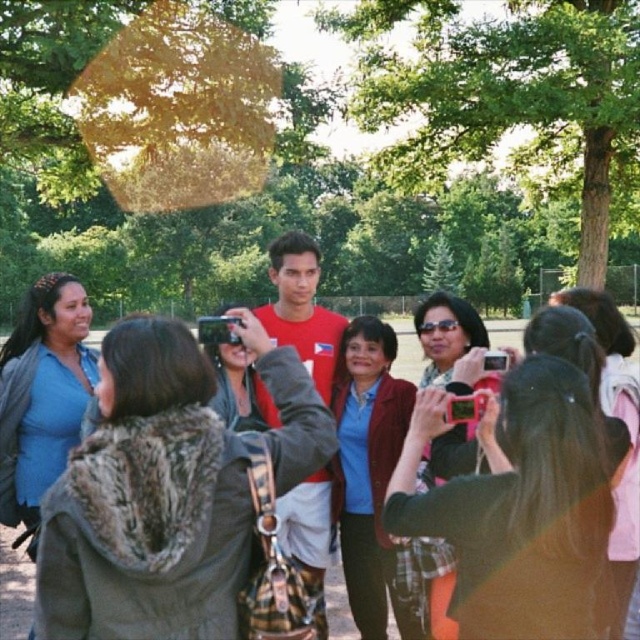
Does matte black jacket at center lie in front of matte blue shirt at center?

Yes, matte black jacket at center is in front of matte blue shirt at center.

Which is in front, point (294, 408) or point (385, 609)?

Point (294, 408) is more forward.

Locate an element on the screen. The image size is (640, 640). matte black jacket at center is located at coordinates (147, 502).

Can you confirm if green leafy tree at center is bigger than matte black sunglasses at center?

Correct, green leafy tree at center is larger in size than matte black sunglasses at center.

Is point (614, 177) positioned after point (452, 355)?

Yes.

Is point (476, 80) closer to camera compared to point (497, 384)?

No, (476, 80) is further to viewer.

Image resolution: width=640 pixels, height=640 pixels. Identify the location of green leafy tree at center. (506, 93).

Identify the location of pink plastic camera at center. The image size is (640, 640). (518, 506).

Does pink plastic camera at center have a greater height compared to matte blue shirt at center?

No, pink plastic camera at center is not taller than matte blue shirt at center.

Does point (577, 468) lie in front of point (372, 556)?

Yes, point (577, 468) is closer to viewer.

This screenshot has height=640, width=640. What are the coordinates of `pink plastic camera at center` in the screenshot? It's located at (518, 506).